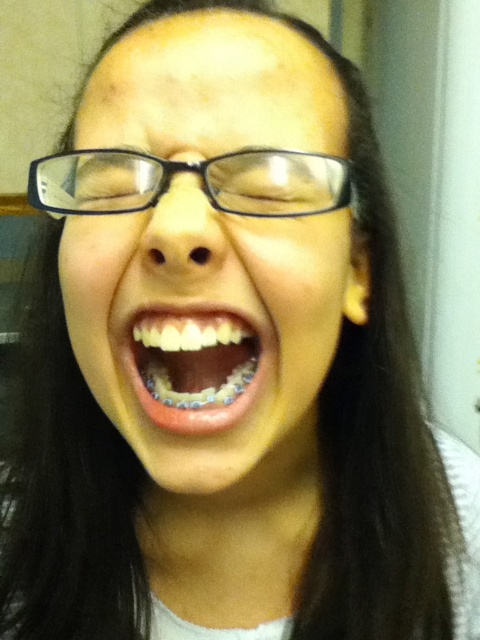
You are a photographer trying to capture a candid shot of the person in the image. Since the clear plastic glasses at center are covering the white glossy teeth at center, will you be able to see the teeth clearly through the glasses?

The clear plastic glasses at center are positioned over the white glossy teeth at center, so yes, you can see the teeth clearly through the glasses since they have clear lenses.

You are a photographer trying to capture a closeup shot of the clear plastic glasses at center and the white glossy teeth at center. Which object should you zoom in on to ensure both fit in the frame without cropping?

The clear plastic glasses at center has a larger width than the white glossy teeth at center, so you should zoom in on the clear plastic glasses at center to ensure both fit in the frame without cropping.

You are a photographer adjusting your camera settings to capture a close focus on the clear plastic glasses at center. The camera has a depth of field range of 10 inches. Will the glasses remain in focus if you focus on an object 10 inches away?

The clear plastic glasses at center is 11.04 inches from the viewer, which is beyond the camera depth of field range of 10 inches. Therefore, the glasses will not remain in focus if focusing on an object 10 inches away.